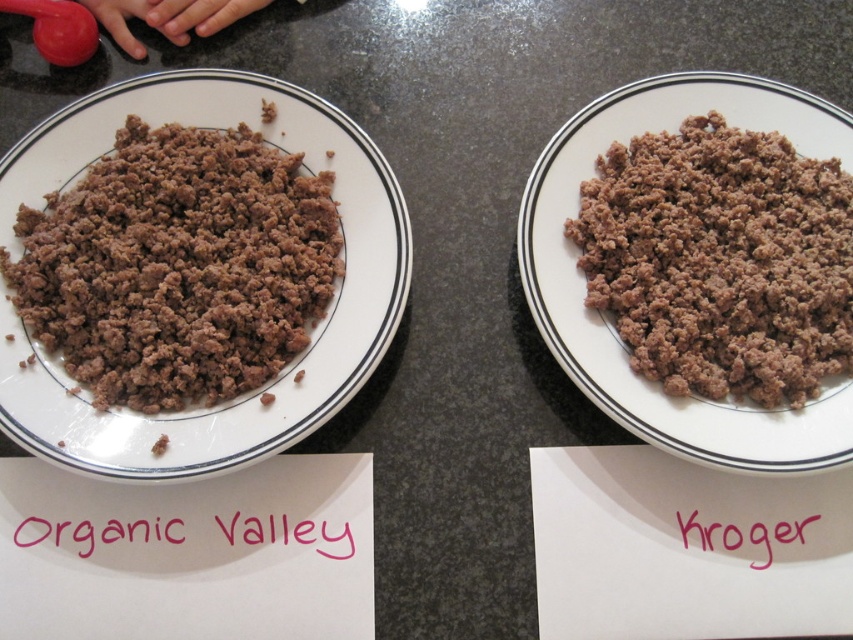
Question: Which point appears farthest from the camera in this image?

Choices:
 (A) tap(352, 540)
 (B) tap(39, 244)
 (C) tap(843, 202)
 (D) tap(700, 524)

Answer: (C)

Question: Which point is farther to the camera?

Choices:
 (A) (686, 260)
 (B) (196, 240)

Answer: (A)

Question: Is brown crumbly ground beef at center behind pink paper at center?

Choices:
 (A) no
 (B) yes

Answer: (A)

Question: Is pink paper at upper center to the right of pink paper at center from the viewer's perspective?

Choices:
 (A) yes
 (B) no

Answer: (B)

Question: From the image, what is the correct spatial relationship of pink paper at upper center in relation to pink paper at center?

Choices:
 (A) above
 (B) below

Answer: (A)

Question: Which point is farther to the camera?

Choices:
 (A) (123, 256)
 (B) (657, 193)

Answer: (B)